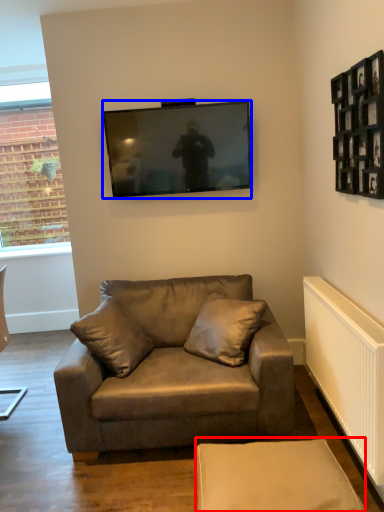
Question: Which object appears closest to the camera in this image, swivel chair (highlighted by a red box) or television (highlighted by a blue box)?

Choices:
 (A) swivel chair
 (B) television

Answer: (A)